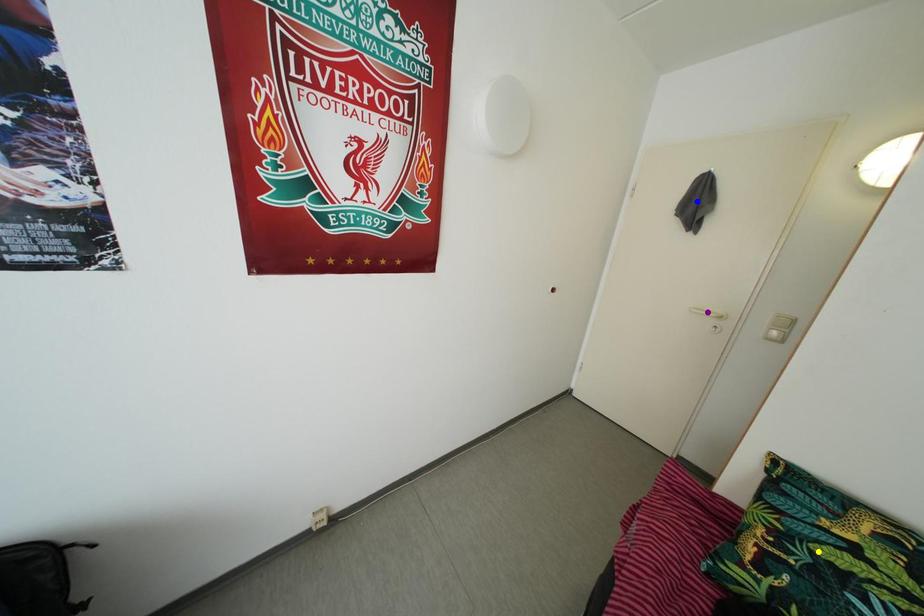
Order these from nearest to farthest:
blue point
purple point
yellow point

purple point
blue point
yellow point